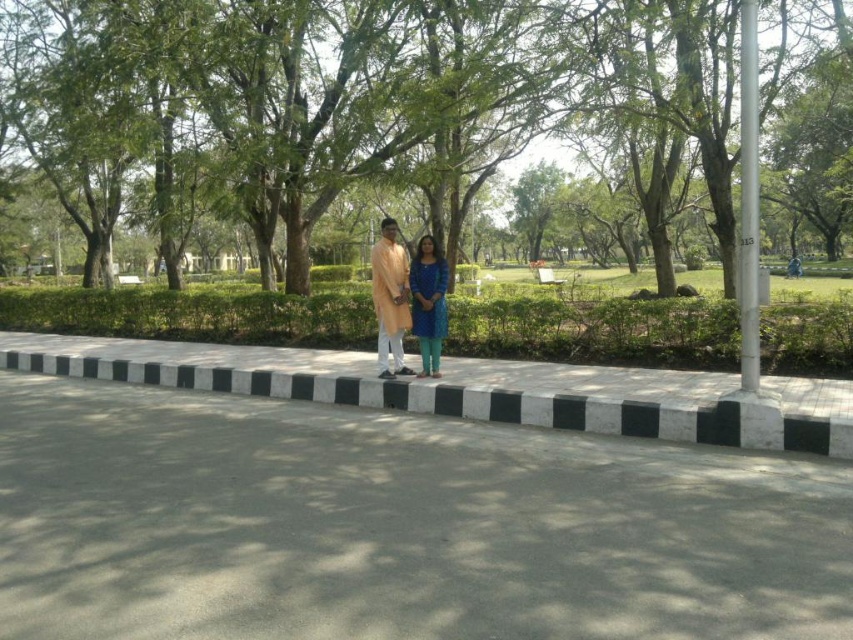
You are planning to place a teal fabric dress at center on the gray asphalt pavement at center. Considering their sizes, will the dress fit entirely on the pavement?

The gray asphalt pavement at center is larger in size than the teal fabric dress at center, so the dress will fit entirely on the pavement.

You are standing at the entrance of the park and want to walk to the gray asphalt pavement at center. According to the coordinates provided, in which direction should you head relative to your current position?

The gray asphalt pavement at center is located at coordinates point (x=396, y=525). Since coordinates typically increase from the bottom left corner, you should head towards the upper right direction from your current position at the entrance.

Based on the photo, you are planning to install a new streetlight in the park. The streetlight needs to be placed in such a way that it doesn t block the view of the green leafy tree at center from the black and white concrete curb at center. Based on their heights, can you determine if the streetlight should be placed closer to the tree or the curb?

The green leafy tree at center is taller than the black and white concrete curb at center. To avoid blocking the view of the tree from the curb, the streetlight should be placed closer to the curb so that the shorter curb doesn t obstruct the line of sight to the taller tree.